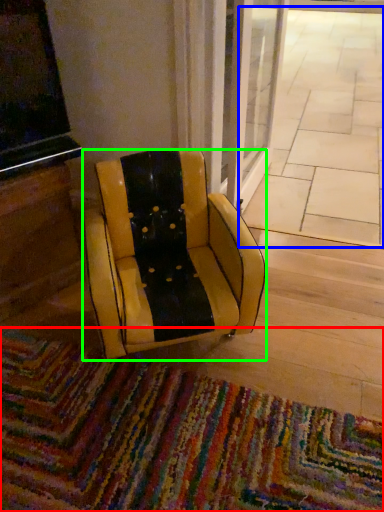
Question: Which object is the closest to the mat (highlighted by a red box)? Choose among these: pavement (highlighted by a blue box) or chair (highlighted by a green box).

Choices:
 (A) pavement
 (B) chair

Answer: (B)